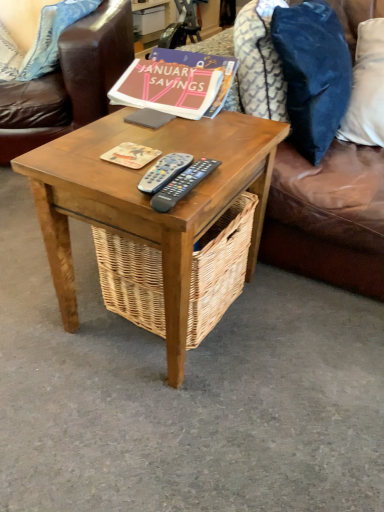
Where is `free point behind matte cardboard coaster at center, which is the 1th book from front to back`? The width and height of the screenshot is (384, 512). free point behind matte cardboard coaster at center, which is the 1th book from front to back is located at coordinates (148, 130).